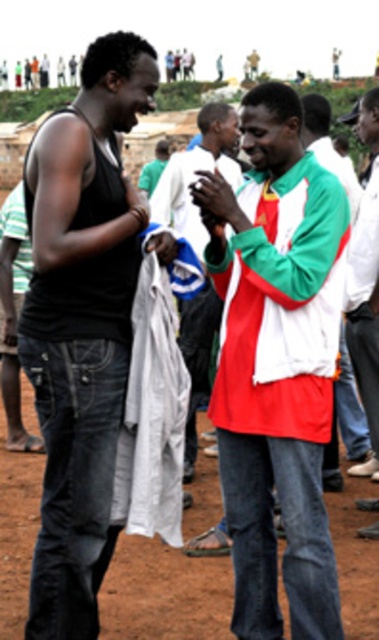
Who is more forward, (x=305, y=604) or (x=189, y=358)?

Positioned in front is point (x=305, y=604).

How much distance is there between red and white jacket at center and white fabric at center?

red and white jacket at center is 7.55 meters from white fabric at center.

Which is in front, point (253, 291) or point (183, 330)?

Point (253, 291) is more forward.

Image resolution: width=379 pixels, height=640 pixels. Identify the location of red and white jacket at center. (277, 364).

Does red and white jacket at center appear on the left side of black denim jeans at left?

No, red and white jacket at center is not to the left of black denim jeans at left.

Does red and white jacket at center come behind black denim jeans at left?

Yes, red and white jacket at center is behind black denim jeans at left.

What are the coordinates of `red and white jacket at center` in the screenshot? It's located at (277, 364).

Where is `red and white jacket at center`? red and white jacket at center is located at coordinates (277, 364).

Consider the image. Between red and white jacket at center and white cotton shirt at center, which one is positioned lower?

red and white jacket at center is below.

Can you confirm if red and white jacket at center is positioned above white cotton shirt at center?

No, red and white jacket at center is not above white cotton shirt at center.

I want to click on red and white jacket at center, so click(x=277, y=364).

Identify the location of red and white jacket at center. Image resolution: width=379 pixels, height=640 pixels. (277, 364).